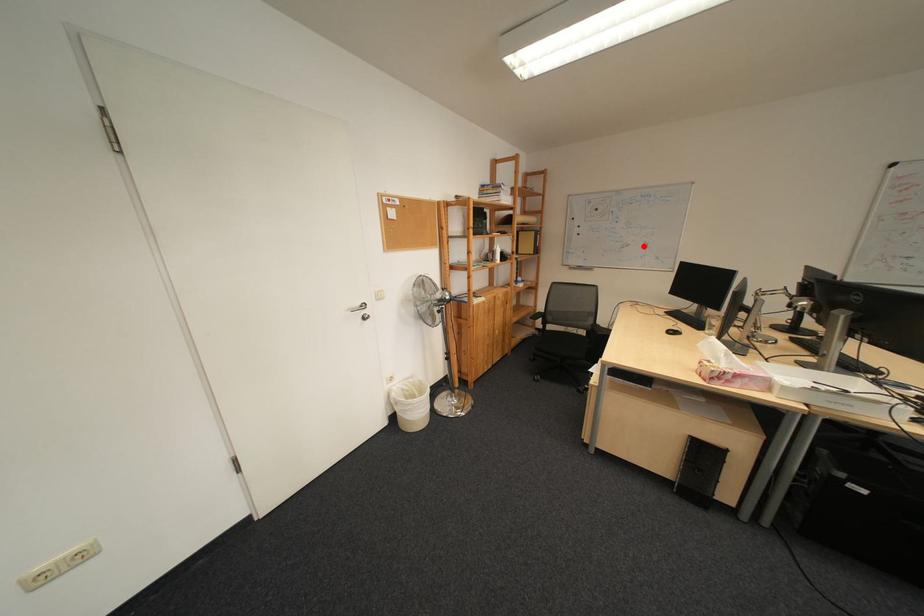
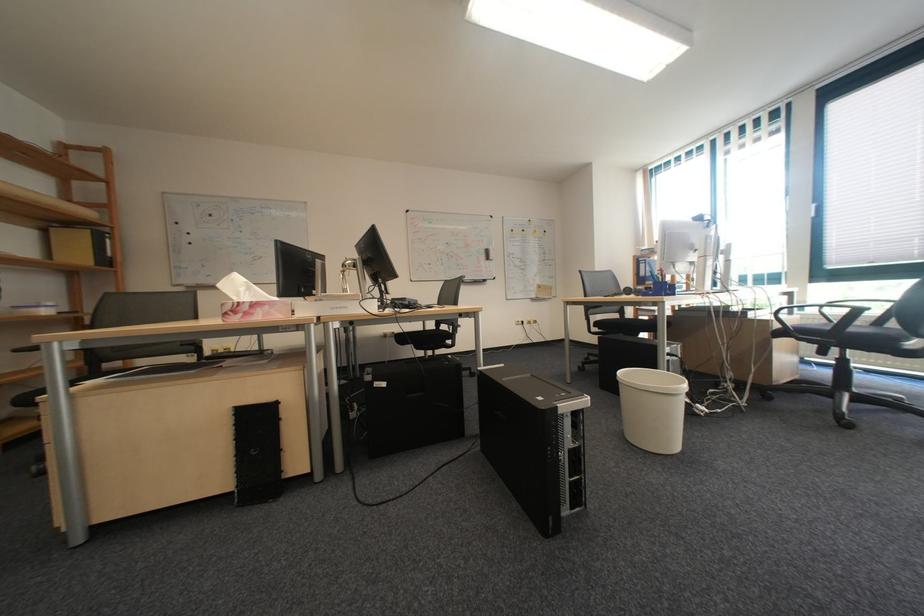
Question: I am providing you with two images of the same scene from different viewpoints. Given a red point in image1, look at the same physical point in image2. Is it:

Choices:
 (A) Closer to the viewpoint
 (B) Farther from the viewpoint

Answer: (A)